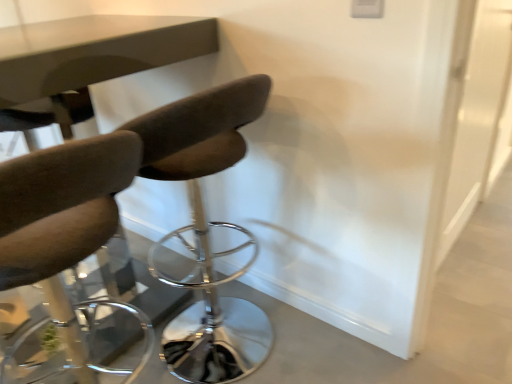
You are a GUI agent. You are given a task and a screenshot of the screen. Output one action in this format:
    pyautogui.click(x=<x>, y=<y>)
    Task: Click on the transparent glass door at right
    The image size is (512, 384).
    Given the screenshot: What is the action you would take?
    pyautogui.click(x=474, y=111)

Describe the element at coordinates (206, 228) in the screenshot. I see `dark brown leather chair at center, the 1th chair from the right` at that location.

In order to click on matte brown chair at left, the 1th chair from the left in this screenshot , I will do `click(62, 217)`.

From a real-world perspective, who is located higher, transparent glass door at right or matte brown chair at left, the second chair positioned from the right?

transparent glass door at right.

Is transparent glass door at right in contact with matte brown chair at left, the 1th chair from the left?

transparent glass door at right and matte brown chair at left, the 1th chair from the left, are not in contact.

Considering the relative positions of transparent glass door at right and matte brown chair at left, the 1th chair from the left, in the image provided, is transparent glass door at right in front of matte brown chair at left, the 1th chair from the left,?

No, transparent glass door at right is behind matte brown chair at left, the 1th chair from the left.

Is matte brown chair at left, the 1th chair from the left, inside transparent glass door at right?

No, matte brown chair at left, the 1th chair from the left, is not inside transparent glass door at right.

What's the angular difference between dark brown leather chair at center, the 1th chair from the right, and matte brown chair at left, the second chair positioned from the right,'s facing directions?

0.000532 degrees separate the facing orientations of dark brown leather chair at center, the 1th chair from the right, and matte brown chair at left, the second chair positioned from the right.

Which is more distant, (191, 104) or (88, 213)?

The point (191, 104) is farther.

Looking at this image, does dark brown leather chair at center, arranged as the second chair when viewed from the left, come behind matte brown chair at left, the second chair positioned from the right?

Yes, it is behind matte brown chair at left, the second chair positioned from the right.

What's the angular difference between transparent glass door at right and dark brown leather chair at center, arranged as the second chair when viewed from the left,'s facing directions?

There is a 173-degree angle between the facing directions of transparent glass door at right and dark brown leather chair at center, arranged as the second chair when viewed from the left.

Considering the sizes of objects transparent glass door at right and dark brown leather chair at center, arranged as the second chair when viewed from the left, in the image provided, who is wider, transparent glass door at right or dark brown leather chair at center, arranged as the second chair when viewed from the left,?

With larger width is dark brown leather chair at center, arranged as the second chair when viewed from the left.

From the image's perspective, starting from the transparent glass door at right, which chair is the 1st one below? Please provide its 2D coordinates.

[(206, 228)]

Which is more to the left, transparent glass door at right or dark brown leather chair at center, arranged as the second chair when viewed from the left?

dark brown leather chair at center, arranged as the second chair when viewed from the left.

From the image's perspective, between matte brown chair at left, the second chair positioned from the right, and transparent glass door at right, who is located below?

From the image's view, matte brown chair at left, the second chair positioned from the right, is below.

Does matte brown chair at left, the 1th chair from the left, come behind transparent glass door at right?

No, matte brown chair at left, the 1th chair from the left, is in front of transparent glass door at right.

In terms of width, does matte brown chair at left, the 1th chair from the left, look wider or thinner when compared to transparent glass door at right?

Considering their sizes, matte brown chair at left, the 1th chair from the left, looks broader than transparent glass door at right.

Considering the relative positions of matte brown chair at left, the 1th chair from the left, and transparent glass door at right in the image provided, is matte brown chair at left, the 1th chair from the left, to the left of transparent glass door at right from the viewer's perspective?

Yes, matte brown chair at left, the 1th chair from the left, is to the left of transparent glass door at right.

Which object is positioned more to the left, matte brown chair at left, the 1th chair from the left, or dark brown leather chair at center, the 1th chair from the right?

matte brown chair at left, the 1th chair from the left, is more to the left.

Is matte brown chair at left, the 1th chair from the left, oriented away from dark brown leather chair at center, arranged as the second chair when viewed from the left?

No, matte brown chair at left, the 1th chair from the left, is not facing away from dark brown leather chair at center, arranged as the second chair when viewed from the left.

Is matte brown chair at left, the 1th chair from the left, bigger than dark brown leather chair at center, arranged as the second chair when viewed from the left?

No, matte brown chair at left, the 1th chair from the left, is not bigger than dark brown leather chair at center, arranged as the second chair when viewed from the left.

Considering the sizes of dark brown leather chair at center, the 1th chair from the right, and transparent glass door at right in the image, is dark brown leather chair at center, the 1th chair from the right, taller or shorter than transparent glass door at right?

dark brown leather chair at center, the 1th chair from the right, is shorter than transparent glass door at right.

Which of these two, dark brown leather chair at center, arranged as the second chair when viewed from the left, or transparent glass door at right, is wider?

dark brown leather chair at center, arranged as the second chair when viewed from the left.

Is dark brown leather chair at center, arranged as the second chair when viewed from the left, inside the boundaries of transparent glass door at right, or outside?

The correct answer is: outside.

Measure the distance between dark brown leather chair at center, the 1th chair from the right, and transparent glass door at right.

dark brown leather chair at center, the 1th chair from the right, is 3.73 feet from transparent glass door at right.

You are a GUI agent. You are given a task and a screenshot of the screen. Output one action in this format:
    pyautogui.click(x=<x>, y=<y>)
    Task: Click on the glass door located above the matte brown chair at left, the second chair positioned from the right (from a real-world perspective)
    The width and height of the screenshot is (512, 384).
    Given the screenshot: What is the action you would take?
    pyautogui.click(x=474, y=111)

Where is `chair on the right side of matte brown chair at left, the 1th chair from the left`? chair on the right side of matte brown chair at left, the 1th chair from the left is located at coordinates (206, 228).

From the image, which object appears to be nearer to transparent glass door at right, matte brown chair at left, the second chair positioned from the right, or dark brown leather chair at center, arranged as the second chair when viewed from the left?

dark brown leather chair at center, arranged as the second chair when viewed from the left, is closer to transparent glass door at right.

From the image, which object appears to be farther from matte brown chair at left, the 1th chair from the left, transparent glass door at right or dark brown leather chair at center, the 1th chair from the right?

Among the two, transparent glass door at right is located further to matte brown chair at left, the 1th chair from the left.

Looking at the image, which one is located further to dark brown leather chair at center, arranged as the second chair when viewed from the left, transparent glass door at right or matte brown chair at left, the 1th chair from the left?

matte brown chair at left, the 1th chair from the left, is positioned further to the anchor dark brown leather chair at center, arranged as the second chair when viewed from the left.

Consider the image. Based on their spatial positions, is matte brown chair at left, the 1th chair from the left, or transparent glass door at right further from dark brown leather chair at center, arranged as the second chair when viewed from the left?

matte brown chair at left, the 1th chair from the left, lies further to dark brown leather chair at center, arranged as the second chair when viewed from the left, than the other object.

Looking at the image, which one is located further to transparent glass door at right, dark brown leather chair at center, arranged as the second chair when viewed from the left, or matte brown chair at left, the 1th chair from the left?

matte brown chair at left, the 1th chair from the left, lies further to transparent glass door at right than the other object.

Estimate the real-world distances between objects in this image. Which object is further from matte brown chair at left, the second chair positioned from the right, dark brown leather chair at center, the 1th chair from the right, or transparent glass door at right?

transparent glass door at right is positioned further to the anchor matte brown chair at left, the second chair positioned from the right.

Where is `chair between matte brown chair at left, the 1th chair from the left, and transparent glass door at right, in the horizontal direction`? The image size is (512, 384). chair between matte brown chair at left, the 1th chair from the left, and transparent glass door at right, in the horizontal direction is located at coordinates (206, 228).